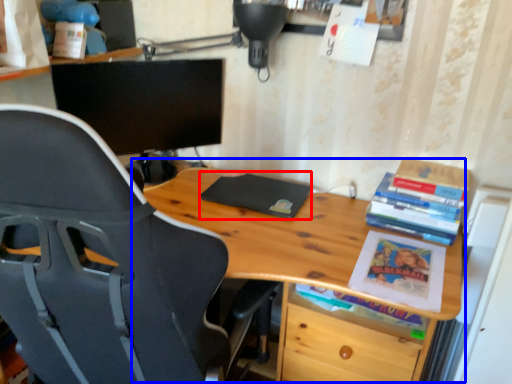
Question: Which object is closer to the camera taking this photo, paperback book (highlighted by a red box) or table (highlighted by a blue box)?

Choices:
 (A) paperback book
 (B) table

Answer: (B)